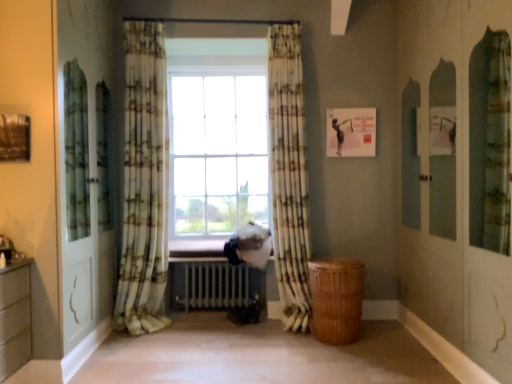
At what (x,y) coordinates should I click in order to perform the action: click on printed fabric curtain at center, the 1th curtain when ordered from left to right. Please return your answer as a coordinate pair (x, y). Looking at the image, I should click on (144, 182).

The height and width of the screenshot is (384, 512). In order to click on printed fabric curtain at center, which appears as the first curtain when viewed from the right in this screenshot , I will do `click(288, 175)`.

I want to click on white metallic radiator at center, so click(213, 284).

Measure the distance between point (214,279) and camera.

Point (214,279) and camera are 12.12 feet apart from each other.

The image size is (512, 384). In order to click on printed fabric curtain at center, the 1th curtain when ordered from left to right in this screenshot , I will do `click(144, 182)`.

From a real-world perspective, is white metallic radiator at center positioned above or below printed fabric curtain at center, which appears as the 2th curtain when viewed from the right?

In terms of real-world spatial position, white metallic radiator at center is below printed fabric curtain at center, which appears as the 2th curtain when viewed from the right.

Which object is closer to the camera taking this photo, white metallic radiator at center or printed fabric curtain at center, the 1th curtain when ordered from left to right?

Positioned in front is printed fabric curtain at center, the 1th curtain when ordered from left to right.

Which is correct: white metallic radiator at center is inside printed fabric curtain at center, the 1th curtain when ordered from left to right, or outside of it?

white metallic radiator at center exists outside the volume of printed fabric curtain at center, the 1th curtain when ordered from left to right.

Is printed fabric curtain at center, the 1th curtain when ordered from left to right, oriented away from white metallic radiator at center?

That's not correct — printed fabric curtain at center, the 1th curtain when ordered from left to right, is not looking away from white metallic radiator at center.

Does point (127, 321) lie behind point (200, 292)?

No, it is not.

Which of these two, printed fabric curtain at center, the 1th curtain when ordered from left to right, or white metallic radiator at center, stands shorter?

white metallic radiator at center is shorter.

Who is more distant, printed fabric curtain at center, the 1th curtain when ordered from left to right, or white metallic radiator at center?

white metallic radiator at center is more distant.

Consider the image. Is white metallic radiator at center far from printed fabric curtain at center, which appears as the first curtain when viewed from the right?

No, there isn't a large distance between white metallic radiator at center and printed fabric curtain at center, which appears as the first curtain when viewed from the right.

Considering the relative positions of white metallic radiator at center and printed fabric curtain at center, which ranks as the 2th curtain in left-to-right order, in the image provided, is white metallic radiator at center to the right of printed fabric curtain at center, which ranks as the 2th curtain in left-to-right order, from the viewer's perspective?

No, white metallic radiator at center is not to the right of printed fabric curtain at center, which ranks as the 2th curtain in left-to-right order.

Is printed fabric curtain at center, which ranks as the 2th curtain in left-to-right order, a part of white metallic radiator at center?

Actually, printed fabric curtain at center, which ranks as the 2th curtain in left-to-right order, is outside white metallic radiator at center.

What are the coordinates of `the 1st curtain above the white metallic radiator at center (from the image's perspective)` in the screenshot? It's located at (288, 175).

How distant is printed fabric curtain at center, the 1th curtain when ordered from left to right, from printed fabric curtain at center, which ranks as the 2th curtain in left-to-right order?

They are 1.02 meters apart.

From the image's perspective, which one is positioned higher, printed fabric curtain at center, which appears as the 2th curtain when viewed from the right, or printed fabric curtain at center, which ranks as the 2th curtain in left-to-right order?

printed fabric curtain at center, which appears as the 2th curtain when viewed from the right, from the image's perspective.

Considering the relative positions of printed fabric curtain at center, which appears as the 2th curtain when viewed from the right, and printed fabric curtain at center, which ranks as the 2th curtain in left-to-right order, in the image provided, is printed fabric curtain at center, which appears as the 2th curtain when viewed from the right, behind printed fabric curtain at center, which ranks as the 2th curtain in left-to-right order,?

No, the depth of printed fabric curtain at center, which appears as the 2th curtain when viewed from the right, is less than that of printed fabric curtain at center, which ranks as the 2th curtain in left-to-right order.

Can you confirm if printed fabric curtain at center, which ranks as the 2th curtain in left-to-right order, is wider than white metallic radiator at center?

No, printed fabric curtain at center, which ranks as the 2th curtain in left-to-right order, is not wider than white metallic radiator at center.

How different are the orientations of printed fabric curtain at center, which appears as the first curtain when viewed from the right, and white metallic radiator at center in degrees?

The facing directions of printed fabric curtain at center, which appears as the first curtain when viewed from the right, and white metallic radiator at center are 89.9 degrees apart.

How distant is printed fabric curtain at center, which ranks as the 2th curtain in left-to-right order, from white metallic radiator at center?

A distance of 28.59 inches exists between printed fabric curtain at center, which ranks as the 2th curtain in left-to-right order, and white metallic radiator at center.

Is printed fabric curtain at center, which appears as the first curtain when viewed from the right, oriented towards white metallic radiator at center?

No, printed fabric curtain at center, which appears as the first curtain when viewed from the right, is not turned towards white metallic radiator at center.

Is printed fabric curtain at center, which appears as the first curtain when viewed from the right, facing away from printed fabric curtain at center, which appears as the 2th curtain when viewed from the right?

That's not correct — printed fabric curtain at center, which appears as the first curtain when viewed from the right, is not looking away from printed fabric curtain at center, which appears as the 2th curtain when viewed from the right.

Is printed fabric curtain at center, which ranks as the 2th curtain in left-to-right order, far away from printed fabric curtain at center, which appears as the 2th curtain when viewed from the right?

Yes, printed fabric curtain at center, which ranks as the 2th curtain in left-to-right order, is far from printed fabric curtain at center, which appears as the 2th curtain when viewed from the right.

Is printed fabric curtain at center, which ranks as the 2th curtain in left-to-right order, bigger or smaller than printed fabric curtain at center, the 1th curtain when ordered from left to right?

In the image, printed fabric curtain at center, which ranks as the 2th curtain in left-to-right order, appears to be smaller than printed fabric curtain at center, the 1th curtain when ordered from left to right.

What are the coordinates of `curtain located underneath the printed fabric curtain at center, the 1th curtain when ordered from left to right (from a real-world perspective)` in the screenshot? It's located at (288, 175).

Locate an element on the screen. The width and height of the screenshot is (512, 384). radiator on the right of printed fabric curtain at center, the 1th curtain when ordered from left to right is located at coordinates (213, 284).

This screenshot has width=512, height=384. I want to click on the 2nd curtain above when counting from the white metallic radiator at center (from the image's perspective), so click(144, 182).

When comparing their distances from printed fabric curtain at center, which appears as the 2th curtain when viewed from the right, does white metallic radiator at center or printed fabric curtain at center, which appears as the first curtain when viewed from the right, seem closer?

white metallic radiator at center is closer to printed fabric curtain at center, which appears as the 2th curtain when viewed from the right.

Considering their positions, is printed fabric curtain at center, which appears as the first curtain when viewed from the right, positioned closer to printed fabric curtain at center, the 1th curtain when ordered from left to right, than white metallic radiator at center?

white metallic radiator at center is closer to printed fabric curtain at center, the 1th curtain when ordered from left to right.

When comparing their distances from printed fabric curtain at center, which appears as the first curtain when viewed from the right, does white metallic radiator at center or printed fabric curtain at center, which appears as the 2th curtain when viewed from the right, seem closer?

The object closer to printed fabric curtain at center, which appears as the first curtain when viewed from the right, is white metallic radiator at center.

When comparing their distances from white metallic radiator at center, does printed fabric curtain at center, the 1th curtain when ordered from left to right, or printed fabric curtain at center, which appears as the first curtain when viewed from the right, seem closer?

printed fabric curtain at center, the 1th curtain when ordered from left to right, is closer to white metallic radiator at center.

In the scene shown: Based on their spatial positions, is printed fabric curtain at center, which ranks as the 2th curtain in left-to-right order, or printed fabric curtain at center, which appears as the 2th curtain when viewed from the right, closer to white metallic radiator at center?

The object closer to white metallic radiator at center is printed fabric curtain at center, which appears as the 2th curtain when viewed from the right.

Based on the photo, estimate the real-world distances between objects in this image. Which object is further from printed fabric curtain at center, which ranks as the 2th curtain in left-to-right order, printed fabric curtain at center, which appears as the 2th curtain when viewed from the right, or white metallic radiator at center?

printed fabric curtain at center, which appears as the 2th curtain when viewed from the right, is further to printed fabric curtain at center, which ranks as the 2th curtain in left-to-right order.

Where is `radiator between printed fabric curtain at center, the 1th curtain when ordered from left to right, and printed fabric curtain at center, which appears as the first curtain when viewed from the right, from left to right`? Image resolution: width=512 pixels, height=384 pixels. radiator between printed fabric curtain at center, the 1th curtain when ordered from left to right, and printed fabric curtain at center, which appears as the first curtain when viewed from the right, from left to right is located at coordinates (213, 284).